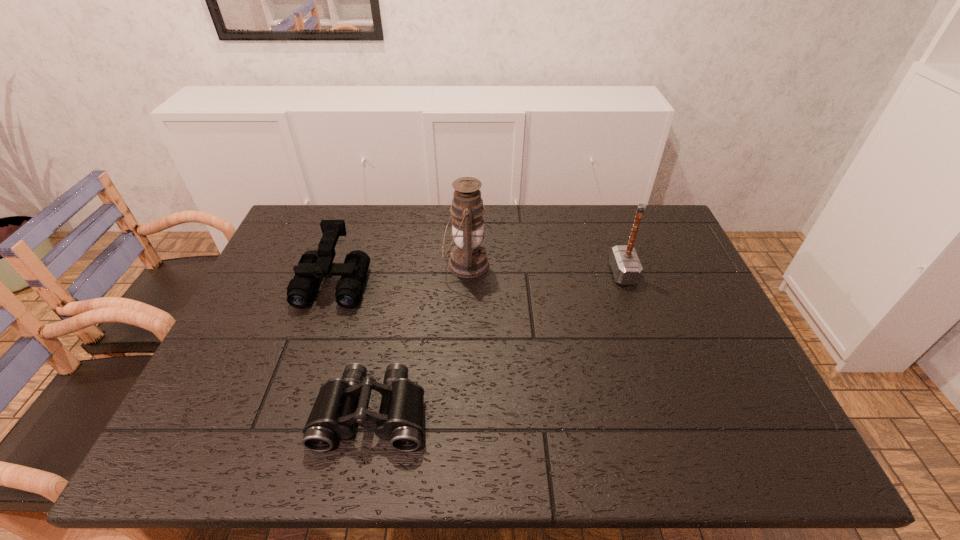
Where is `the tallest object`? The image size is (960, 540). the tallest object is located at coordinates (468, 259).

You are a GUI agent. You are given a task and a screenshot of the screen. Output one action in this format:
    pyautogui.click(x=<x>, y=<y>)
    Task: Click on the second object from right to left
    
    Given the screenshot: What is the action you would take?
    pyautogui.click(x=468, y=259)

Locate an element on the screen. the rightmost object is located at coordinates (626, 267).

Where is `the third shortest object`? This screenshot has width=960, height=540. the third shortest object is located at coordinates (626, 267).

In order to click on the second shortest object in this screenshot , I will do `click(313, 265)`.

Locate an element on the screen. The height and width of the screenshot is (540, 960). the taller binoculars is located at coordinates (313, 265).

This screenshot has width=960, height=540. What are the coordinates of `the nearest object` in the screenshot? It's located at (340, 403).

You are a GUI agent. You are given a task and a screenshot of the screen. Output one action in this format:
    pyautogui.click(x=<x>, y=<y>)
    Task: Click on the nearer binoculars
    The height and width of the screenshot is (540, 960).
    Given the screenshot: What is the action you would take?
    pyautogui.click(x=340, y=403)

Locate an element on the screen. The height and width of the screenshot is (540, 960). vacant area located on the back of the oil lamp is located at coordinates (468, 206).

In order to click on free space located 0.060m on the striking surface of the rightmost object in this screenshot , I will do `click(591, 273)`.